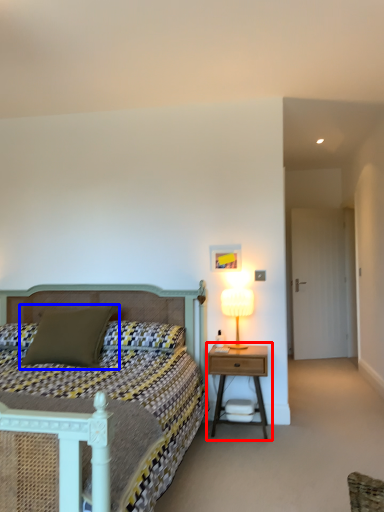
Question: Which object is further to the camera taking this photo, nightstand (highlighted by a red box) or pillow (highlighted by a blue box)?

Choices:
 (A) nightstand
 (B) pillow

Answer: (A)